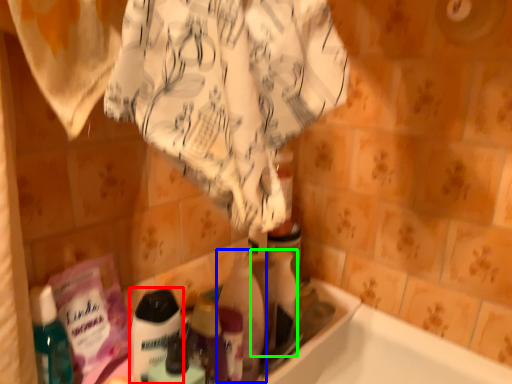
Question: Which object is positioned farthest from cleaning product (highlighted by a red box)? Select from cleaning product (highlighted by a blue box) and cleaning product (highlighted by a green box).

Choices:
 (A) cleaning product
 (B) cleaning product

Answer: (B)